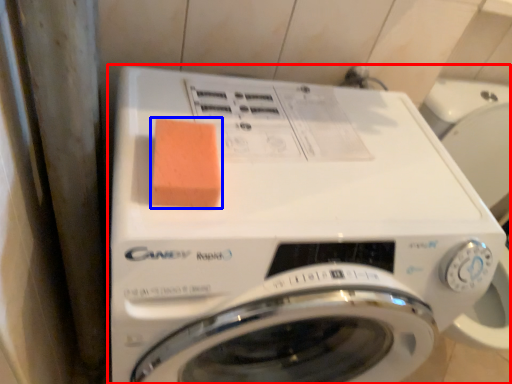
Question: Among these objects, which one is nearest to the camera, washing machine (highlighted by a red box) or food (highlighted by a blue box)?

Choices:
 (A) washing machine
 (B) food

Answer: (A)